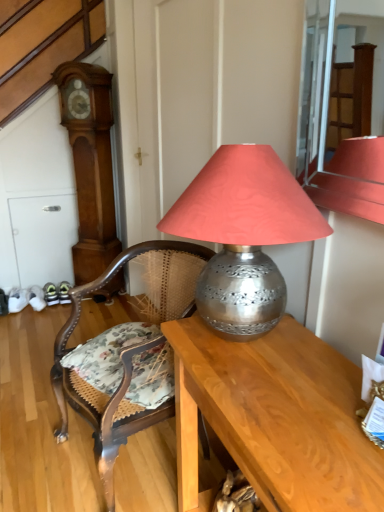
Where is `vacant space underneath wooden cane chair at center (from a real-world perspective)`? vacant space underneath wooden cane chair at center (from a real-world perspective) is located at coordinates (140, 464).